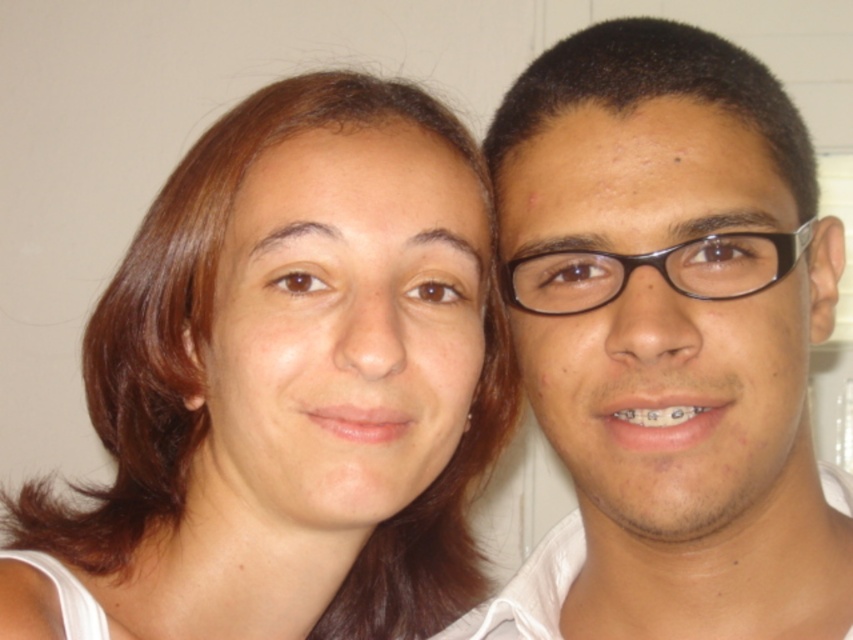
Question: Which point is closer to the camera?

Choices:
 (A) pos(178,445)
 (B) pos(734,115)

Answer: (B)

Question: Is brown hair at center positioned at the back of matte black glasses at right?

Choices:
 (A) no
 (B) yes

Answer: (B)

Question: Among these points, which one is farthest from the camera?

Choices:
 (A) (537, 346)
 (B) (358, 611)

Answer: (B)

Question: Is brown hair at center below matte black glasses at right?

Choices:
 (A) yes
 (B) no

Answer: (A)

Question: Observing the image, what is the correct spatial positioning of brown hair at center in reference to matte black glasses at right?

Choices:
 (A) left
 (B) right

Answer: (A)